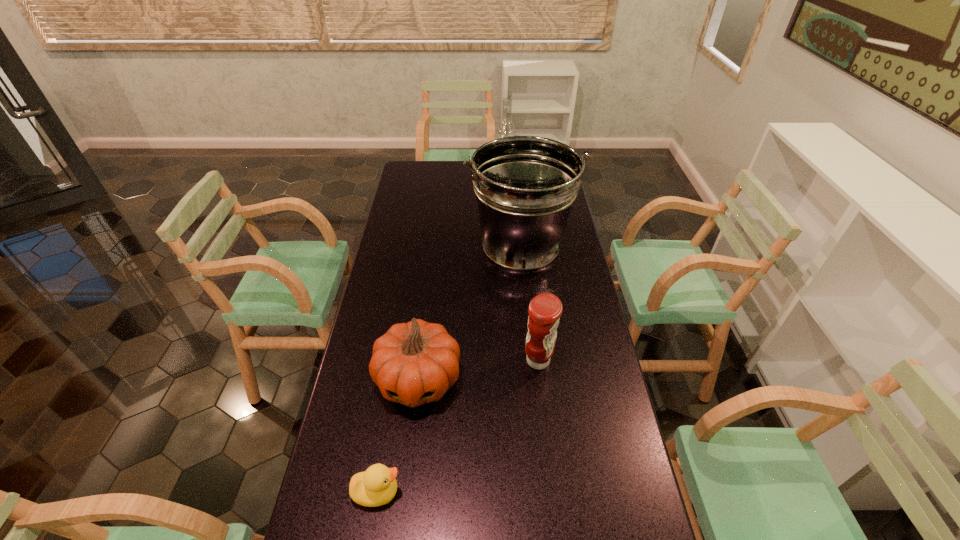
Locate an element on the screen. This screenshot has width=960, height=540. vacant space located on the face of the shortest object is located at coordinates (537, 492).

This screenshot has height=540, width=960. Identify the location of object that is at the far edge. (506, 128).

Identify the location of pumpkin that is at the left edge. This screenshot has height=540, width=960. (414, 363).

Image resolution: width=960 pixels, height=540 pixels. I want to click on duckling positioned at the left edge, so click(376, 486).

Identify the location of bucket present at the right edge. (525, 186).

Where is `condiment at the right edge`? Image resolution: width=960 pixels, height=540 pixels. condiment at the right edge is located at coordinates (545, 310).

In order to click on vacant area at the far edge of the desktop in this screenshot , I will do `click(460, 163)`.

This screenshot has width=960, height=540. In order to click on free region at the left edge in this screenshot , I will do `click(386, 276)`.

You are a GUI agent. You are given a task and a screenshot of the screen. Output one action in this format:
    pyautogui.click(x=<x>, y=<y>)
    Task: Click on the free space at the right edge
    
    Given the screenshot: What is the action you would take?
    pyautogui.click(x=604, y=424)

Where is `vacant region at the far left corner of the desktop`? vacant region at the far left corner of the desktop is located at coordinates (418, 180).